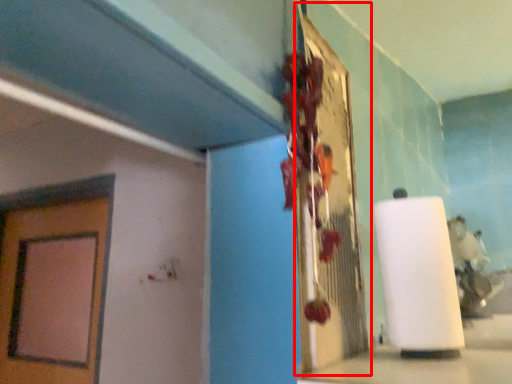
Question: Observing the image, what is the correct spatial positioning of bulletin board (annotated by the red box) in reference to paper towel?

Choices:
 (A) right
 (B) left

Answer: (B)